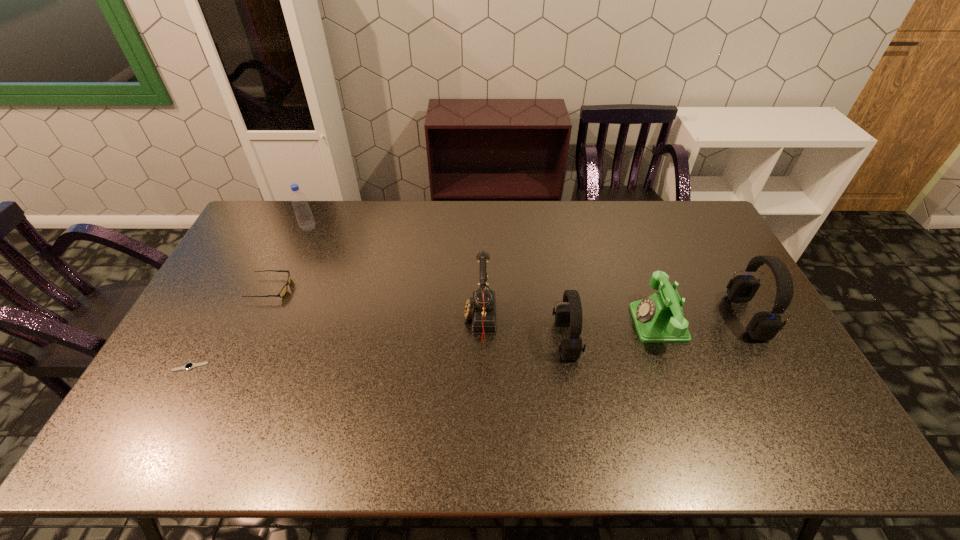
This screenshot has width=960, height=540. I want to click on vacant region located on the dial of the shorter telephone, so click(x=545, y=323).

Image resolution: width=960 pixels, height=540 pixels. I want to click on vacant point located on the right of the shortest object, so click(232, 367).

This screenshot has width=960, height=540. I want to click on vacant space situated on the dial of the fourth object from right to left, so click(333, 320).

Locate an element on the screen. The height and width of the screenshot is (540, 960). vacant space located 0.080m on the dial of the fourth object from right to left is located at coordinates 438,320.

You are a GUI agent. You are given a task and a screenshot of the screen. Output one action in this format:
    pyautogui.click(x=<x>, y=<y>)
    Task: Click on the vacant region located 0.150m on the dial of the fourth object from right to left
    The width and height of the screenshot is (960, 540).
    Given the screenshot: What is the action you would take?
    pyautogui.click(x=414, y=320)

The width and height of the screenshot is (960, 540). Find the location of `object that is positioned at the far edge`. object that is positioned at the far edge is located at coordinates (306, 222).

The width and height of the screenshot is (960, 540). I want to click on sunglasses that is at the left edge, so click(x=283, y=291).

Find the location of a particular element. The width and height of the screenshot is (960, 540). watch at the left edge is located at coordinates (190, 365).

Locate an element on the screen. object that is at the right edge is located at coordinates (764, 326).

Image resolution: width=960 pixels, height=540 pixels. In the image, there is a desktop. Identify the location of free space at the far edge. (372, 200).